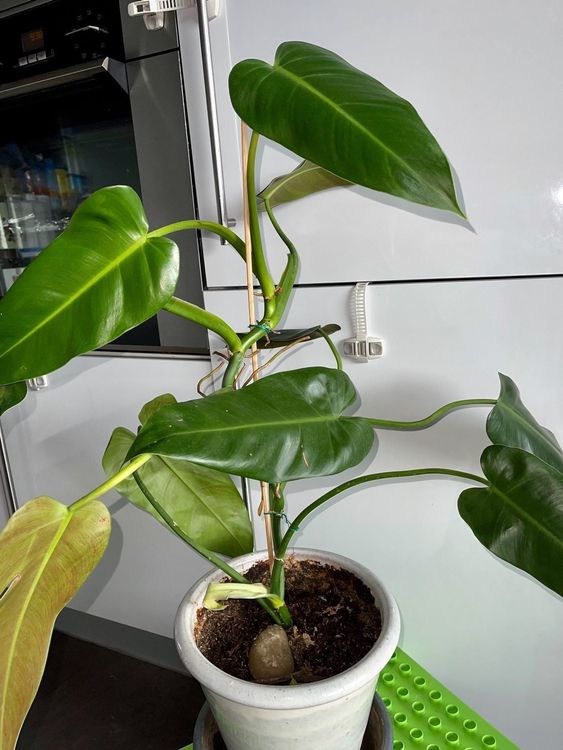
You are a GUI agent. You are given a task and a screenshot of the screen. Output one action in this format:
    pyautogui.click(x=<x>, y=<y>)
    Task: Click on the sick plant
    The image size is (563, 750).
    Given the screenshot: What is the action you would take?
    pyautogui.click(x=67, y=548)